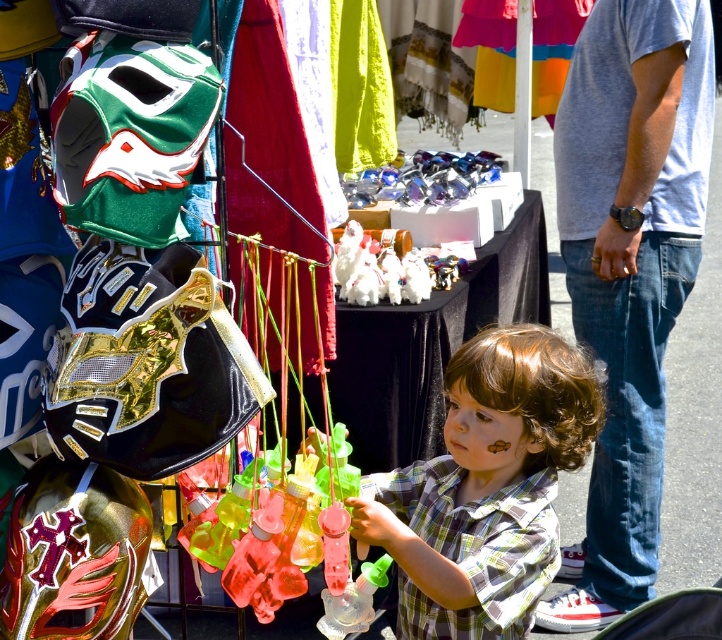
Question: Does gray cotton t-shirt at right have a lesser width compared to plaid shirt toddler at center?

Choices:
 (A) yes
 (B) no

Answer: (A)

Question: Which object is farther from the camera taking this photo?

Choices:
 (A) gray cotton t-shirt at right
 (B) plaid shirt toddler at center

Answer: (A)

Question: Which point is farther from the camera taking this photo?

Choices:
 (A) (355, 250)
 (B) (526, 556)

Answer: (A)

Question: Which of the following is the farthest from the observer?

Choices:
 (A) gray cotton t-shirt at right
 (B) plaid shirt toddler at center

Answer: (A)

Question: Does plaid shirt toddler at center have a lesser width compared to white plush toy at center?

Choices:
 (A) yes
 (B) no

Answer: (B)

Question: Does plaid shirt toddler at center have a smaller size compared to white plush toy at center?

Choices:
 (A) no
 (B) yes

Answer: (A)